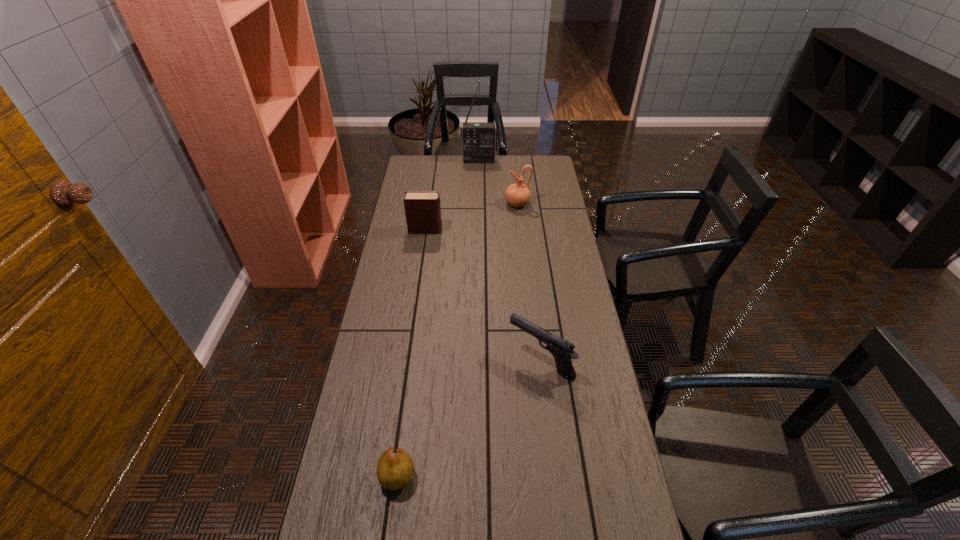
This screenshot has height=540, width=960. Identify the location of free space located 0.300m on the spout of the fourth nearest object. (441, 204).

Where is `free space located on the spine side of the third nearest object`? free space located on the spine side of the third nearest object is located at coordinates (472, 230).

In order to click on vacant space situated at the muzzle of the gun in this screenshot , I will do `click(478, 360)`.

Identify the location of free space located at the muzzle of the gun. (422, 360).

You are a GUI agent. You are given a task and a screenshot of the screen. Output one action in this format:
    pyautogui.click(x=<x>, y=<y>)
    Task: Click on the free space located at the muzzle of the gun
    The height and width of the screenshot is (540, 960).
    Given the screenshot: What is the action you would take?
    pyautogui.click(x=438, y=360)

Where is `vacant region located on the back of the shortest object`? Image resolution: width=960 pixels, height=540 pixels. vacant region located on the back of the shortest object is located at coordinates (412, 365).

Locate an element on the screen. The image size is (960, 540). object at the far edge is located at coordinates (479, 140).

Find the location of a particular element. The width and height of the screenshot is (960, 540). diary at the left edge is located at coordinates pyautogui.click(x=422, y=208).

This screenshot has height=540, width=960. I want to click on pear located in the left edge section of the desktop, so pos(395,468).

Image resolution: width=960 pixels, height=540 pixels. In order to click on pottery at the right edge in this screenshot , I will do tap(517, 195).